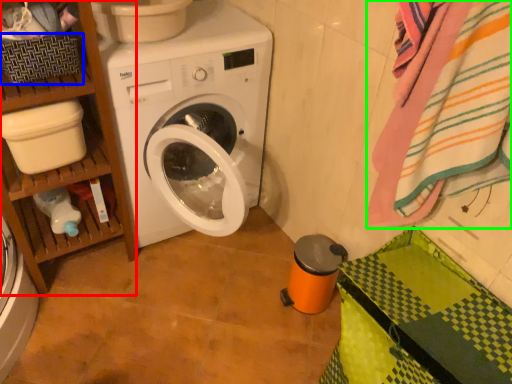
Question: Estimate the real-world distances between objects in this image. Which object is closer to shelf (highlighted by a red box), basket (highlighted by a blue box) or bath towel (highlighted by a green box)?

Choices:
 (A) basket
 (B) bath towel

Answer: (A)